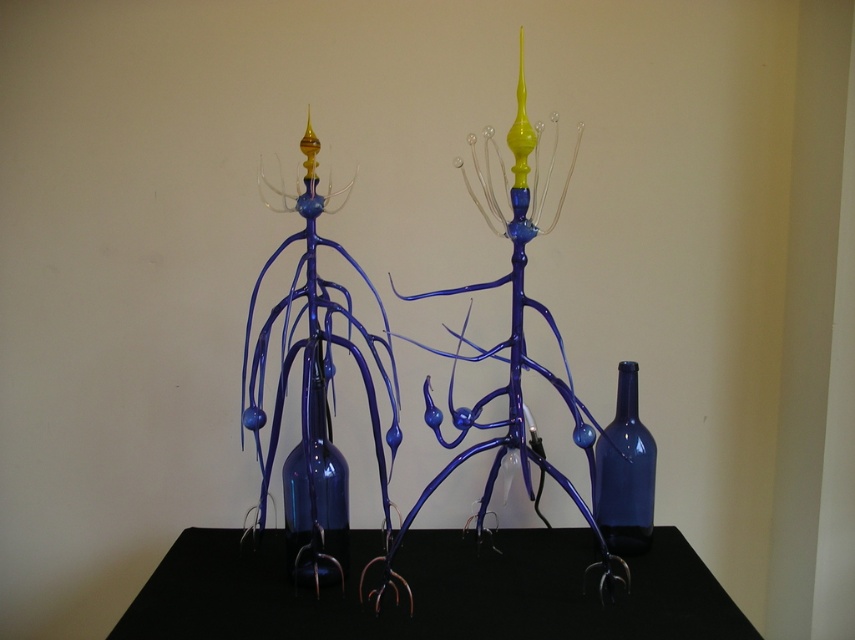
Between point (569, 529) and point (596, 461), which one is positioned behind?

The point (569, 529) is more distant.

Is black matte table at center in front of transparent blue glass bottle at right?

That is True.

Describe the element at coordinates (433, 592) in the screenshot. I see `black matte table at center` at that location.

The image size is (855, 640). I want to click on black matte table at center, so click(433, 592).

Where is `transparent blue glass bottle at center`? The image size is (855, 640). transparent blue glass bottle at center is located at coordinates (316, 499).

Measure the distance between transparent blue glass bottle at center and camera.

A distance of 1.19 meters exists between transparent blue glass bottle at center and camera.

Which is behind, point (326, 406) or point (596, 449)?

The point (596, 449) is behind.

This screenshot has height=640, width=855. In order to click on transparent blue glass bottle at center in this screenshot , I will do `click(316, 499)`.

Is black matte table at center to the left of transparent blue glass bottle at center from the viewer's perspective?

Incorrect, black matte table at center is not on the left side of transparent blue glass bottle at center.

Consider the image. Does black matte table at center appear over transparent blue glass bottle at center?

No.

Between point (196, 540) and point (340, 508), which one is positioned behind?

Positioned behind is point (196, 540).

Image resolution: width=855 pixels, height=640 pixels. Identify the location of black matte table at center. (433, 592).